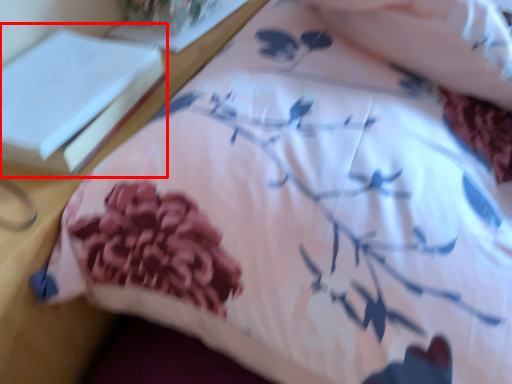
Question: Observing the image, what is the correct spatial positioning of book (annotated by the red box) in reference to book?

Choices:
 (A) left
 (B) right

Answer: (A)